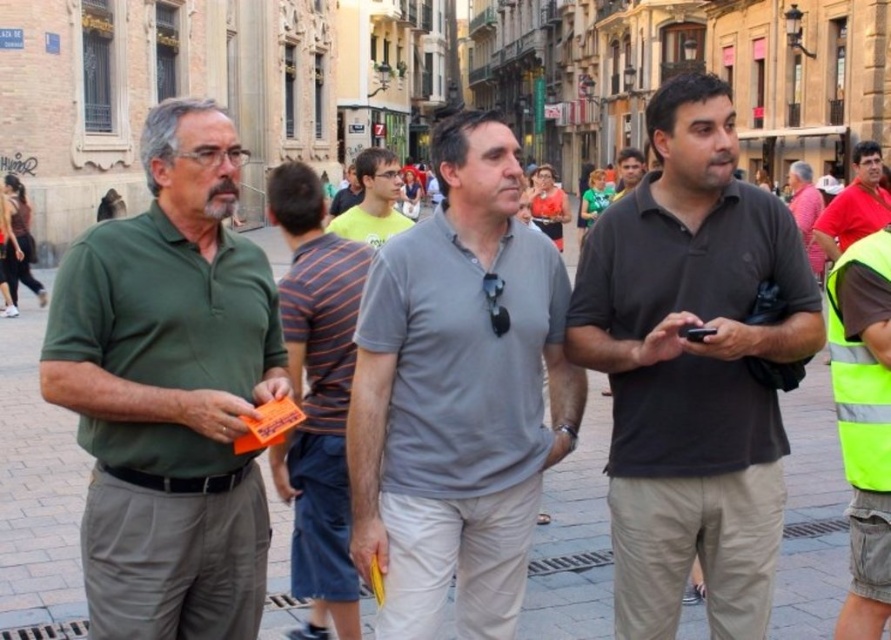
Question: Among these points, which one is nearest to the camera?

Choices:
 (A) (356, 211)
 (B) (102, 497)

Answer: (B)

Question: Is gray cotton shirt at center bigger than high-visibility yellow safety vest at right?

Choices:
 (A) no
 (B) yes

Answer: (A)

Question: Which of these objects is positioned closest to the high-visibility yellow safety vest at right?

Choices:
 (A) light gray shirt at center
 (B) red matte shirt at upper right
 (C) striped cotton shirt at center

Answer: (B)

Question: Is striped cotton shirt at center below red matte shirt at upper right?

Choices:
 (A) yes
 (B) no

Answer: (A)

Question: Which object is positioned closest to the gray cotton shirt at center?

Choices:
 (A) striped cotton shirt at center
 (B) light gray shirt at center

Answer: (A)

Question: Is gray cotton shirt at center positioned at the back of striped cotton shirt at center?

Choices:
 (A) no
 (B) yes

Answer: (A)